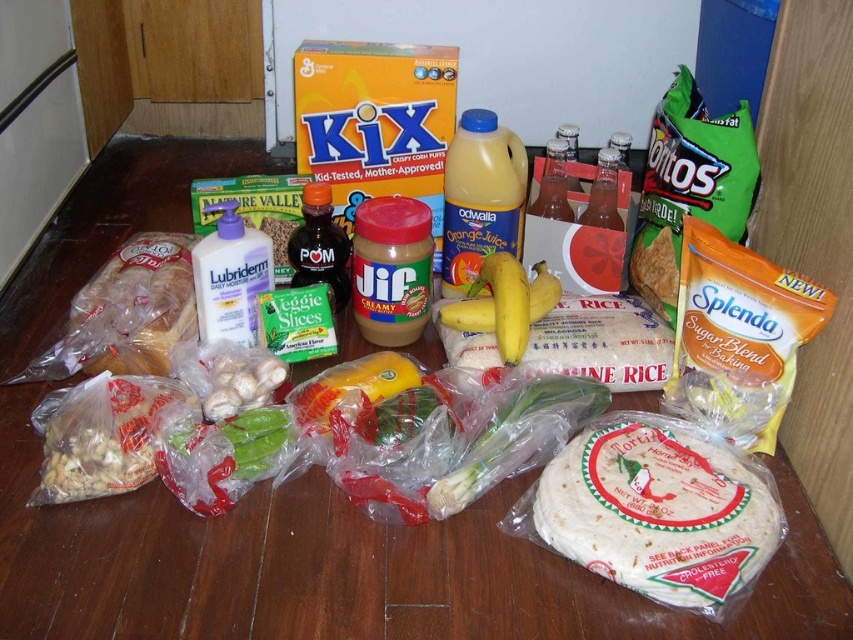
You are organizing groceries on a shelf and need to stack items vertically. You have a white paper tortilla at lower right and a yellow translucent bottle at center. Which item should you place at the bottom to ensure stability?

The yellow translucent bottle at center should be placed at the bottom because it is taller than the white paper tortilla at lower right, providing a stable base for stacking.

You are organizing groceries on a kitchen counter and need to place the white paper tortilla at lower right and the yellow translucent bottle at center. The counter has a 20 inch wide space available. Can both items fit side by side in this space without overlapping?

The distance between the white paper tortilla at lower right and yellow translucent bottle at center is 20.29 inches, which is slightly wider than the 20 inch space available. Therefore, they cannot fit side by side without overlapping.

You are standing at the center of the scene and want to pick up the white paper tortilla at lower right. Based on its coordinates, in which direction should you move to reach it?

The white paper tortilla at lower right is located at coordinates point (660, 509), so you should move to the lower right direction to reach it.